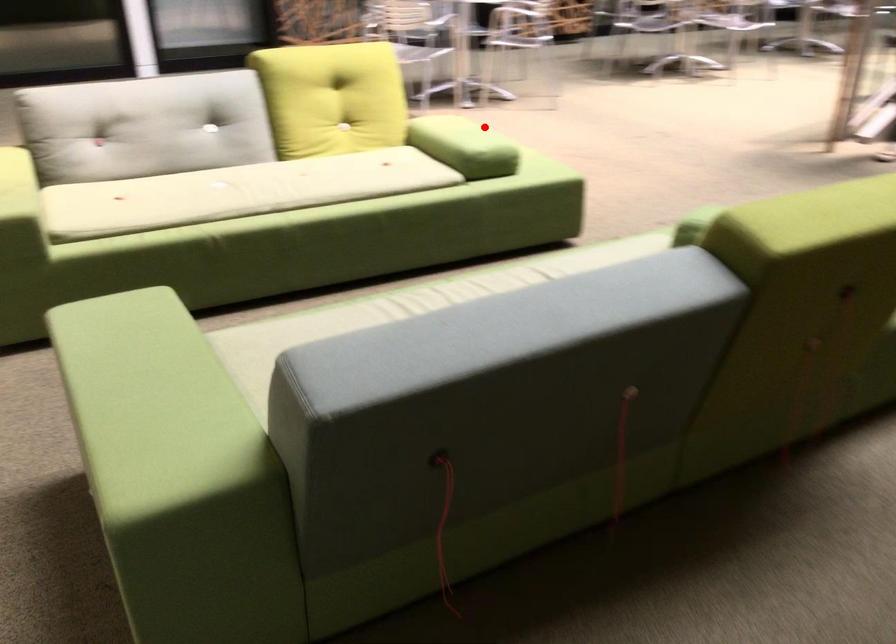
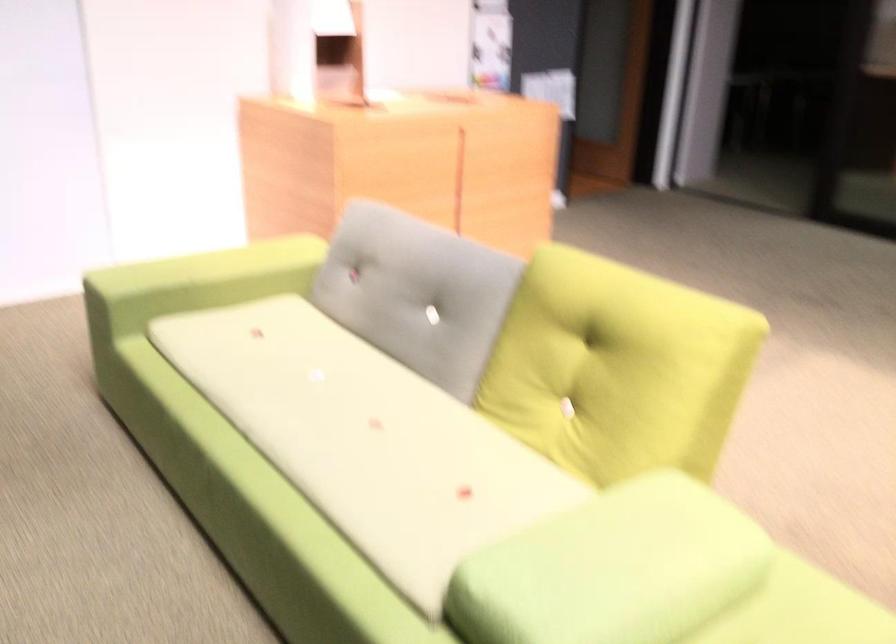
Question: A red point is marked in image1. In image2, is the corresponding 3D point closer to the camera or farther? Reply with the corresponding letter.

Choices:
 (A) The corresponding 3D point is closer.
 (B) The corresponding 3D point is farther.

Answer: (A)